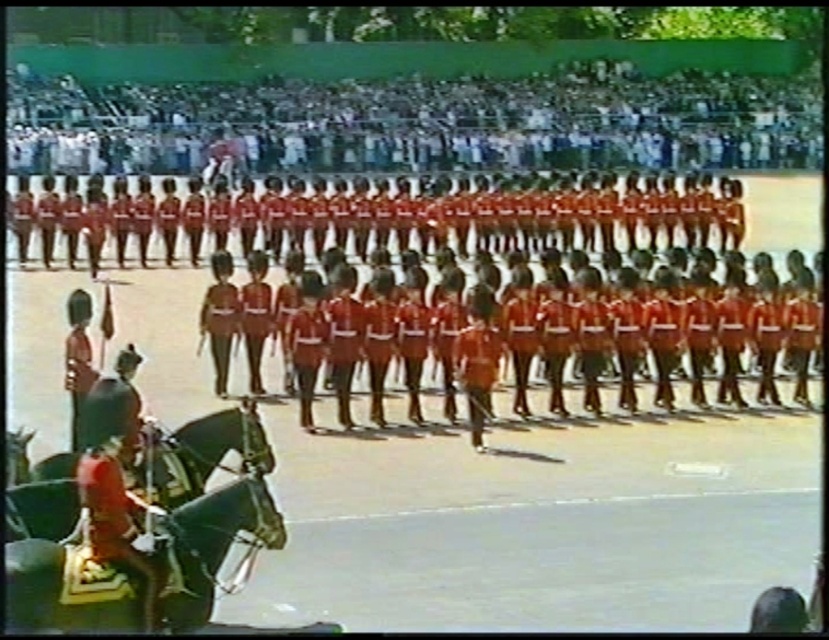
Question: Which of these objects is positioned closest to the shiny red uniform at left?

Choices:
 (A) black glossy horse at lower left
 (B) shiny red uniform at center
 (C) shiny black horse at lower left

Answer: (C)

Question: Where is shiny red uniform at center located in relation to shiny black horse at lower left in the image?

Choices:
 (A) right
 (B) left

Answer: (A)

Question: Which of these objects is positioned closest to the shiny red uniform at left?

Choices:
 (A) shiny red uniform at center
 (B) black glossy horse at lower left
 (C) shiny black horse at lower left

Answer: (C)

Question: Is shiny red uniform at center below black glossy horse at lower left?

Choices:
 (A) yes
 (B) no

Answer: (B)

Question: Which point is farther from the camera taking this photo?

Choices:
 (A) (170, 440)
 (B) (90, 547)

Answer: (A)

Question: Does shiny red uniform at center have a greater width compared to shiny red uniform at left?

Choices:
 (A) yes
 (B) no

Answer: (B)